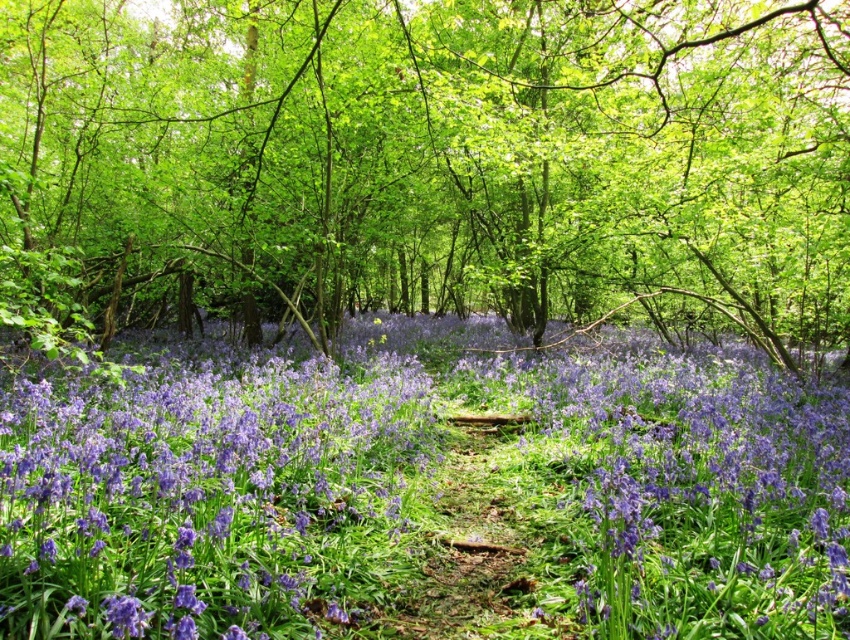
Is green leafy tree at center wider than purple matte flower at center?

Yes, green leafy tree at center is wider than purple matte flower at center.

Does green leafy tree at center appear on the left side of purple matte flower at center?

Indeed, green leafy tree at center is positioned on the left side of purple matte flower at center.

What do you see at coordinates (428, 166) in the screenshot? Image resolution: width=850 pixels, height=640 pixels. I see `green leafy tree at center` at bounding box center [428, 166].

You are a GUI agent. You are given a task and a screenshot of the screen. Output one action in this format:
    pyautogui.click(x=<x>, y=<y>)
    Task: Click on the green leafy tree at center
    This screenshot has height=640, width=850.
    Given the screenshot: What is the action you would take?
    pyautogui.click(x=428, y=166)